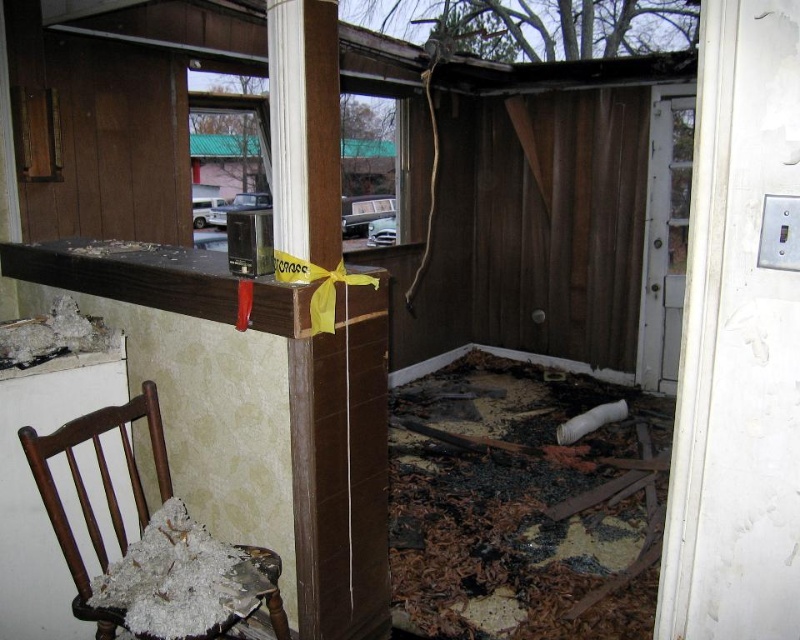
You are a firefighter assessing the structural integrity of the damaged room. You notice the brown wood pillar at center and the wooden chair with shredded fabric at lower left. Based on their positions, which object is closer to the ceiling?

The brown wood pillar at center is located above the wooden chair with shredded fabric at lower left, meaning it is closer to the ceiling.

You are a firefighter assessing the scene. You need to locate the charcoal debris at lower center. According to the coordinates provided, where exactly is it positioned in the room?

The charcoal debris at lower center is located at point (524, 506) in the room.